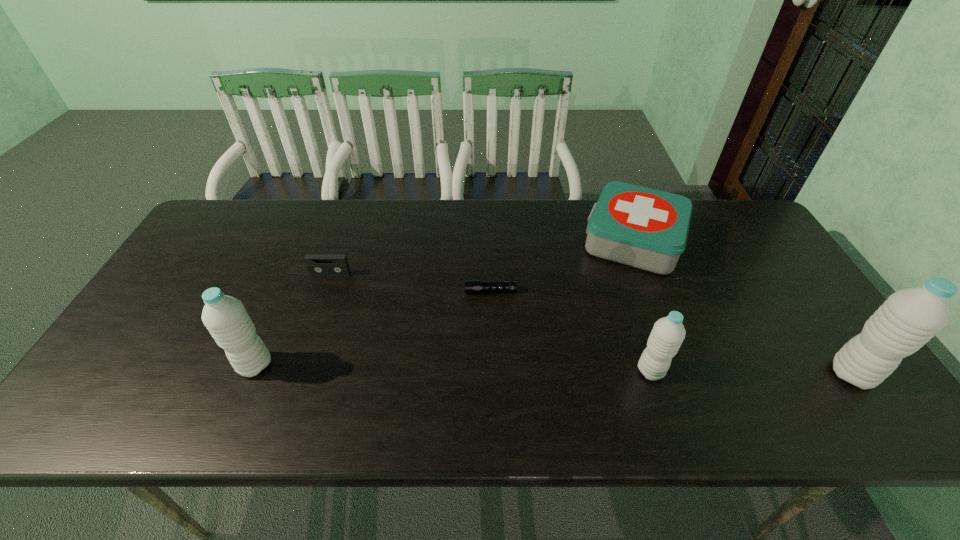
Where is `the fifth tallest object`? Image resolution: width=960 pixels, height=540 pixels. the fifth tallest object is located at coordinates (318, 265).

Where is `blank area located 0.080m on the left of the second tallest water bottle`? This screenshot has width=960, height=540. blank area located 0.080m on the left of the second tallest water bottle is located at coordinates (204, 365).

Identify the location of blank area located 0.340m on the right of the third tallest object. The width and height of the screenshot is (960, 540). [x=809, y=371].

This screenshot has width=960, height=540. In order to click on vacant area situated on the left of the tallest water bottle in this screenshot , I will do `click(724, 374)`.

Identify the location of free location located 0.060m on the right of the fourth tallest object. The height and width of the screenshot is (540, 960). point(707,241).

This screenshot has height=540, width=960. I want to click on vacant area situated 0.270m at the lens end of the fourth nearest object, so click(367, 291).

The image size is (960, 540). In order to click on vacant position located at the lens end of the fourth nearest object in this screenshot , I will do `click(389, 291)`.

Where is `vacant area located at the lens end of the fourth nearest object`? vacant area located at the lens end of the fourth nearest object is located at coordinates (320, 291).

Image resolution: width=960 pixels, height=540 pixels. I want to click on vacant region located 0.260m on the front-facing side of the videotape, so tap(304, 352).

At what (x,y) coordinates should I click in order to perform the action: click on object present at the far edge. Please return your answer as a coordinate pair (x, y). The height and width of the screenshot is (540, 960). Looking at the image, I should click on (641, 227).